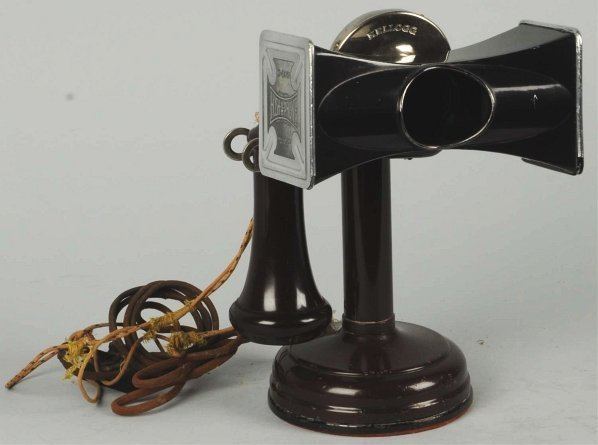
What are the coordinates of `spotted yellow cord` in the screenshot? It's located at (219, 284).